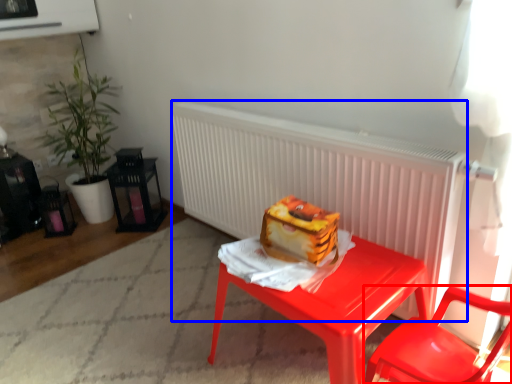
Question: Which object appears farthest to the camera in this image, chair (highlighted by a red box) or radiator (highlighted by a blue box)?

Choices:
 (A) chair
 (B) radiator

Answer: (B)